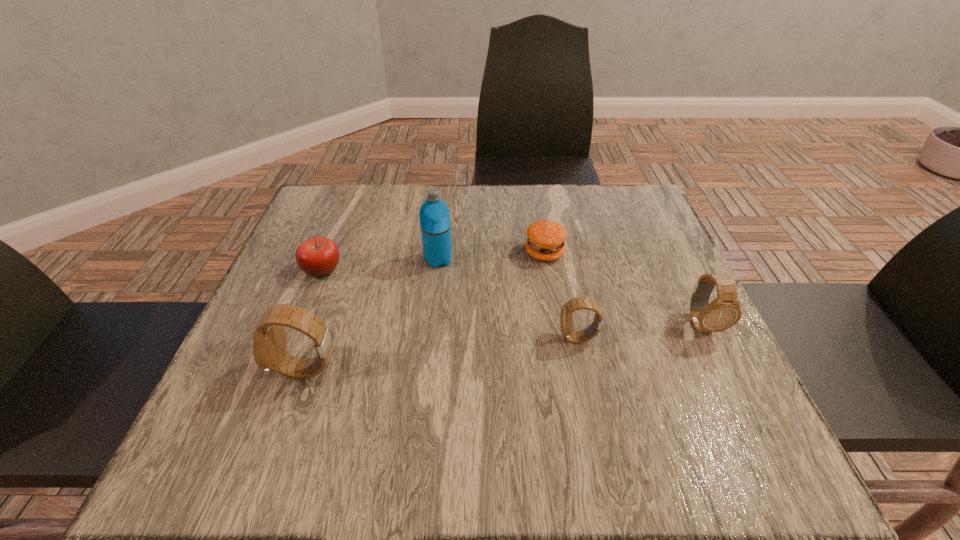
The width and height of the screenshot is (960, 540). I want to click on object at the right edge, so click(x=724, y=312).

You are a GUI agent. You are given a task and a screenshot of the screen. Output one action in this format:
    pyautogui.click(x=<x>, y=<y>)
    Task: Click on the object that is positioned at the near left corner
    The height and width of the screenshot is (540, 960).
    Given the screenshot: What is the action you would take?
    pyautogui.click(x=269, y=341)

Locate an element on the screen. vacant region at the far edge of the desktop is located at coordinates (526, 205).

In the image, there is a desktop. Find the location of `vacant space at the near edge`. vacant space at the near edge is located at coordinates (348, 374).

Locate an element on the screen. The height and width of the screenshot is (540, 960). vacant space at the right edge is located at coordinates (618, 294).

This screenshot has width=960, height=540. I want to click on vacant space at the far left corner of the desktop, so click(339, 219).

In the image, there is a desktop. At what (x,y) coordinates should I click in order to perform the action: click on vacant space at the far right corner. Please return your answer as a coordinate pair (x, y). Looking at the image, I should click on (655, 237).

This screenshot has width=960, height=540. In order to click on blank region between the second tallest object and the second tallest watch in this screenshot , I will do `click(504, 347)`.

The height and width of the screenshot is (540, 960). Identify the location of empty location between the third tallest object and the shortest object. (622, 288).

What are the coordinates of `free spot between the rightmost object and the shortest watch` in the screenshot? It's located at (639, 331).